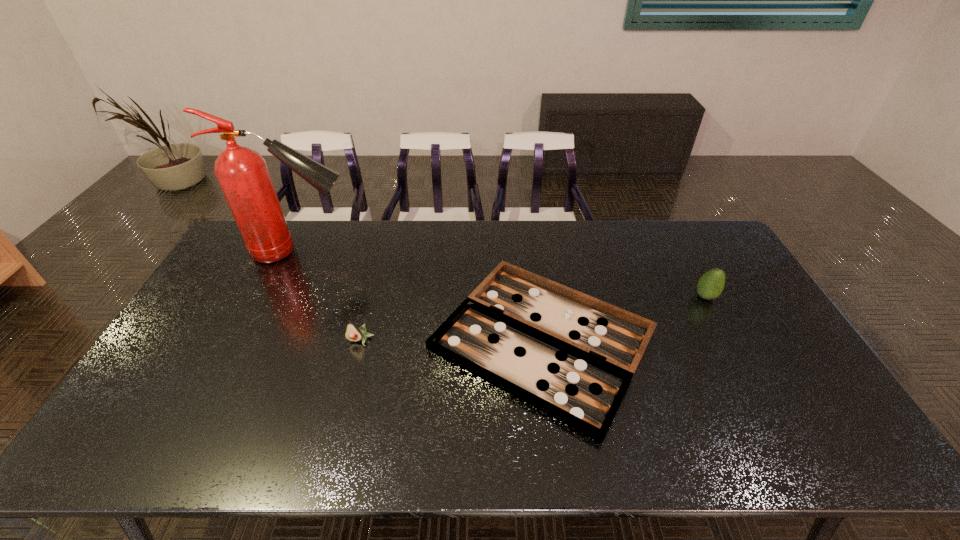
The image size is (960, 540). Find the location of `free space between the third object from right to left and the leftmost object`. free space between the third object from right to left and the leftmost object is located at coordinates (330, 296).

In order to click on free spot between the fire extinguisher and the gameboard in this screenshot , I will do [421, 296].

Identify the location of free point between the shorter avocado and the tallest object. This screenshot has height=540, width=960. (330, 296).

This screenshot has height=540, width=960. Find the location of `unoccupied position between the nearer avocado and the tallest object`. unoccupied position between the nearer avocado and the tallest object is located at coordinates (330, 296).

You are a GUI agent. You are given a task and a screenshot of the screen. Output one action in this format:
    pyautogui.click(x=<x>, y=<y>)
    Task: Click on the empty location between the shortest object and the fire extinguisher
    The height and width of the screenshot is (540, 960).
    Given the screenshot: What is the action you would take?
    pyautogui.click(x=421, y=296)

What are the coordinates of `the closest object relative to the third shortest object` in the screenshot? It's located at (572, 356).

Identify the location of object that stands as the second closest to the fire extinguisher. (353, 333).

Find the location of `free space that satisfies the following two spatial constraints: 1. on the back side of the third object from left to right; 2. at the nozzle end of the farthest object`. free space that satisfies the following two spatial constraints: 1. on the back side of the third object from left to right; 2. at the nozzle end of the farthest object is located at coordinates (531, 252).

Identify the location of free space that satisfies the following two spatial constraints: 1. at the nozzle end of the right avocado; 2. on the left side of the tallest object. (278, 296).

The image size is (960, 540). What are the coordinates of `vacant area that satisfies the following two spatial constraints: 1. at the nozzle end of the gameboard; 2. on the right side of the leftmost object` in the screenshot? It's located at (257, 340).